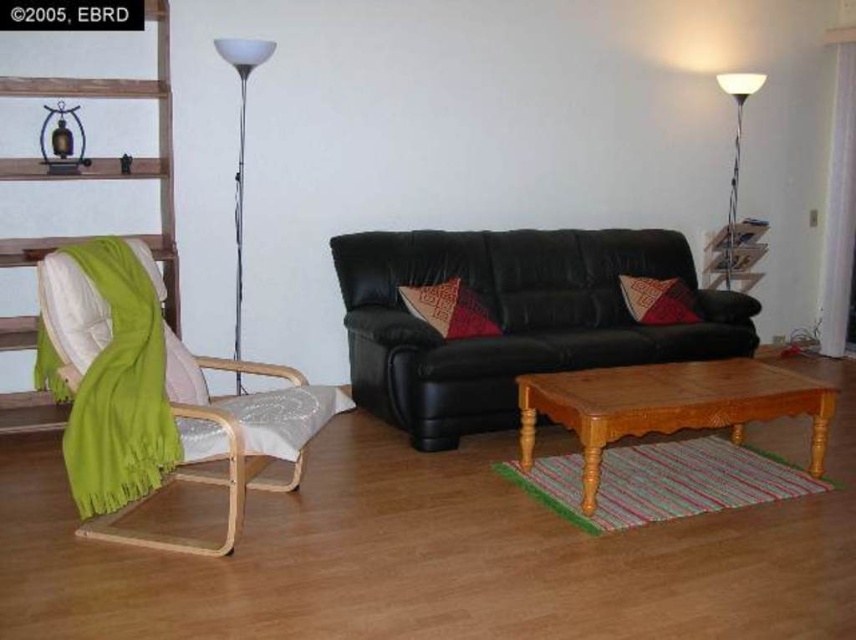
Who is positioned more to the left, red woven pillow at center or reddish-brown textured pillow at center?

From the viewer's perspective, reddish-brown textured pillow at center appears more on the left side.

Is red woven pillow at center smaller than reddish-brown textured pillow at center?

Correct, red woven pillow at center occupies less space than reddish-brown textured pillow at center.

The width and height of the screenshot is (856, 640). What do you see at coordinates (657, 300) in the screenshot?
I see `red woven pillow at center` at bounding box center [657, 300].

Find the location of a particular element. red woven pillow at center is located at coordinates (657, 300).

Is point (444, 448) positioned before point (158, 241)?

That is True.

Between black leather couch at center and green fabric chair at left, which one appears on the left side from the viewer's perspective?

From the viewer's perspective, green fabric chair at left appears more on the left side.

Between point (428, 353) and point (163, 65), which one is positioned in front?

Point (163, 65) is more forward.

Where is `black leather couch at center`? black leather couch at center is located at coordinates (513, 317).

Does black leather couch at center have a smaller size compared to light brown wooden coffee table at center?

No.

Between point (423, 440) and point (825, 385), which one is positioned behind?

Positioned behind is point (423, 440).

The width and height of the screenshot is (856, 640). Find the location of `black leather couch at center`. black leather couch at center is located at coordinates [x=513, y=317].